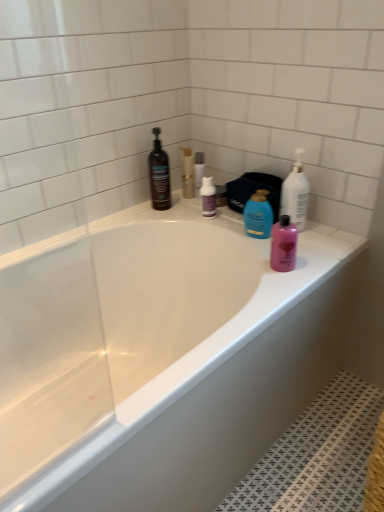
Where is `free space between purple matte bottle at center, arranged as the third cleaning product when viewed from the right, and matte black bottle at upper left, which is the 1th cleaning product from left to right`? free space between purple matte bottle at center, arranged as the third cleaning product when viewed from the right, and matte black bottle at upper left, which is the 1th cleaning product from left to right is located at coordinates (181, 215).